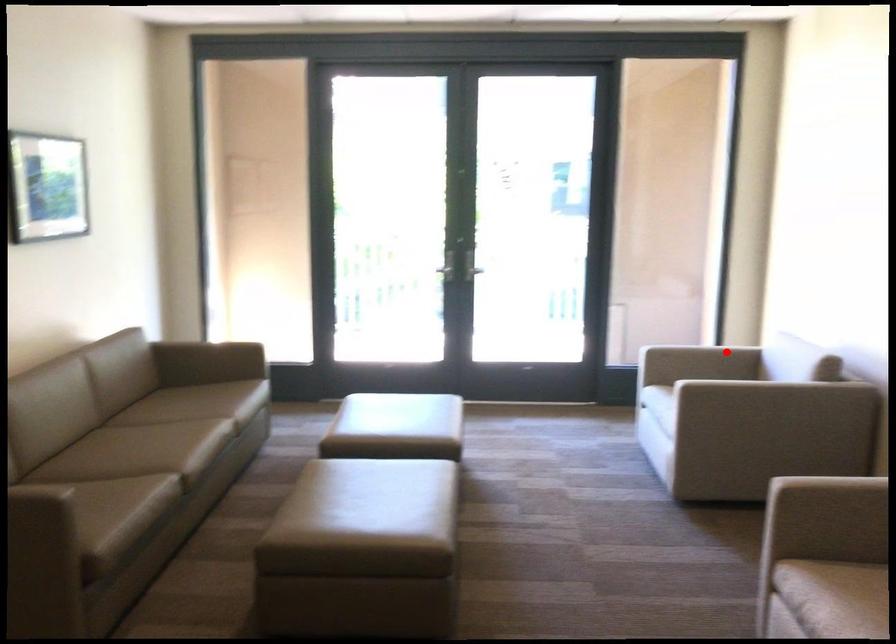
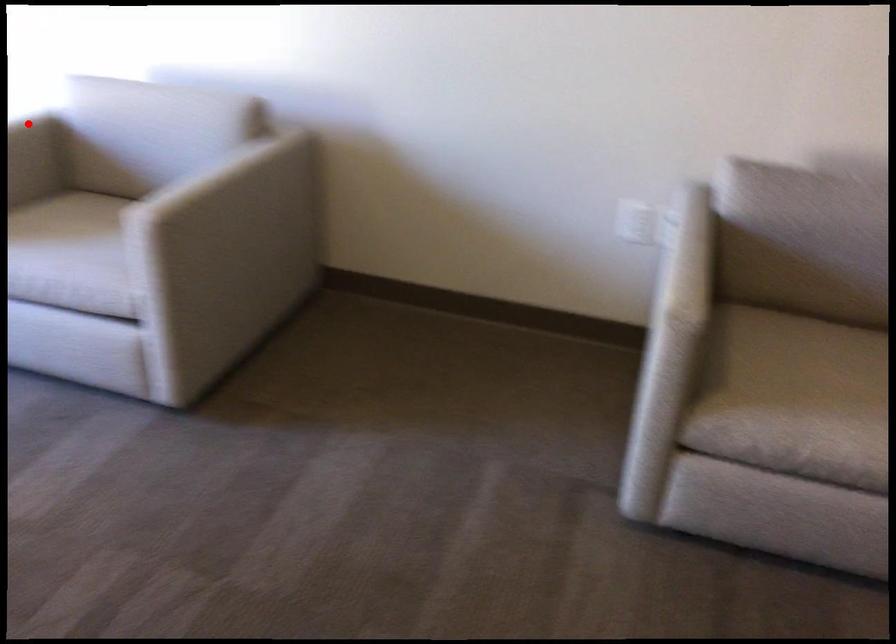
I am providing you with two images of the same scene from different viewpoints. A red point is marked on the first image and another point is marked on the second image. Do the highlighted points in image1 and image2 indicate the same real-world spot?

Yes